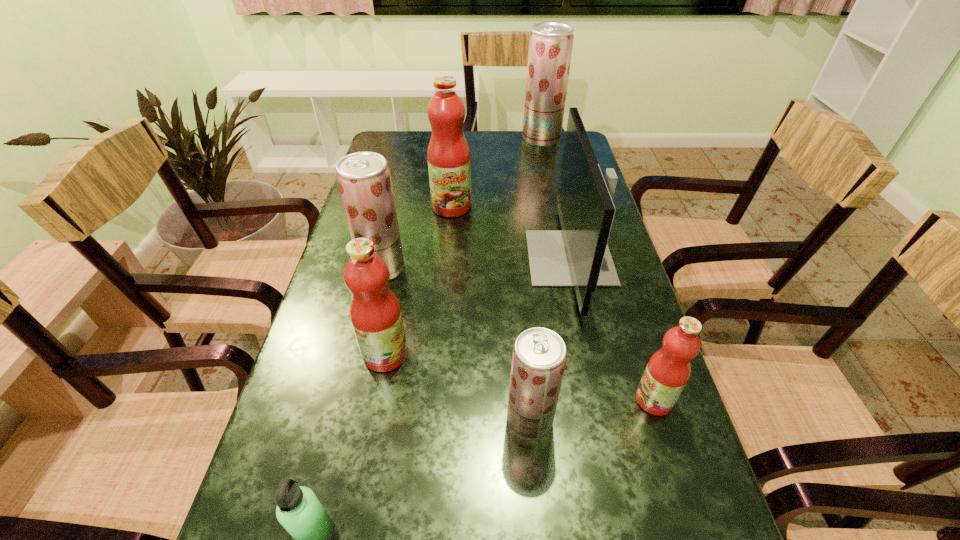
Locate an element on the screen. The height and width of the screenshot is (540, 960). the farthest fruit juice is located at coordinates (550, 48).

You are a GUI agent. You are given a task and a screenshot of the screen. Output one action in this format:
    pyautogui.click(x=<x>, y=<y>)
    Task: Click on the second fruit juice from right to left
    
    Given the screenshot: What is the action you would take?
    click(x=550, y=48)

Find the location of a particular element. Image resolution: width=960 pixels, height=540 pixels. the second pink fruit juice from right to left is located at coordinates (449, 162).

I want to click on the fifth nearest fruit juice, so click(x=449, y=162).

Image resolution: width=960 pixels, height=540 pixels. I want to click on computer monitor, so click(578, 255).

You are a GUI agent. You are given a task and a screenshot of the screen. Output one action in this format:
    pyautogui.click(x=<x>, y=<y>)
    Task: Click on the fourth nearest fruit juice
    This screenshot has width=960, height=540.
    Given the screenshot: What is the action you would take?
    pyautogui.click(x=364, y=180)

The image size is (960, 540). In order to click on the second nearest strawberry fruit juice in this screenshot , I will do `click(364, 180)`.

Where is `the fifth farthest object`? The height and width of the screenshot is (540, 960). the fifth farthest object is located at coordinates (375, 313).

The height and width of the screenshot is (540, 960). Identify the location of the leftmost pink fruit juice. (375, 313).

Where is `the nearest strawberry fruit juice`? the nearest strawberry fruit juice is located at coordinates (539, 355).